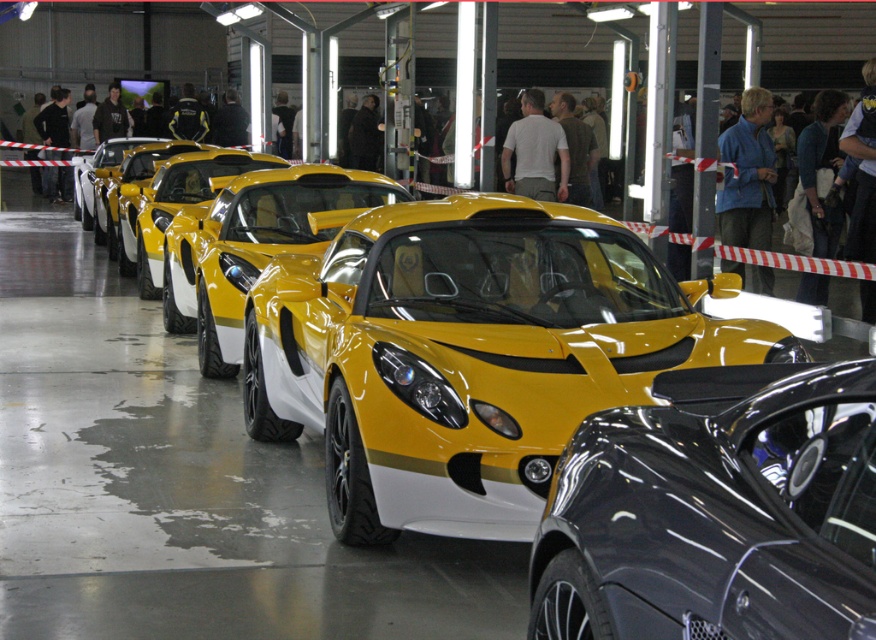
You are a delivery driver who needs to park a new car in the industrial space shown. The glossy black car at center and the yellow glossy sports car at center are already parked there. Which car should you avoid if you need to park a vehicle that is the same size as the yellow glossy sports car?

You should avoid parking near the glossy black car at center because it is smaller than the yellow glossy sports car at center, so there might be less space available compared to the area around the larger yellow car.

You are a photographer planning to take a photo of the yellow matte sports car at center and the yellow glossy sports car at center. You want to ensure that both cars are visible in the frame. Based on their positions, which car should you focus on first to include both in the shot?

You should focus on the yellow glossy sports car at center first because the yellow matte sports car at center is positioned to its right, allowing both to be captured in the frame when centered on the glossy one.